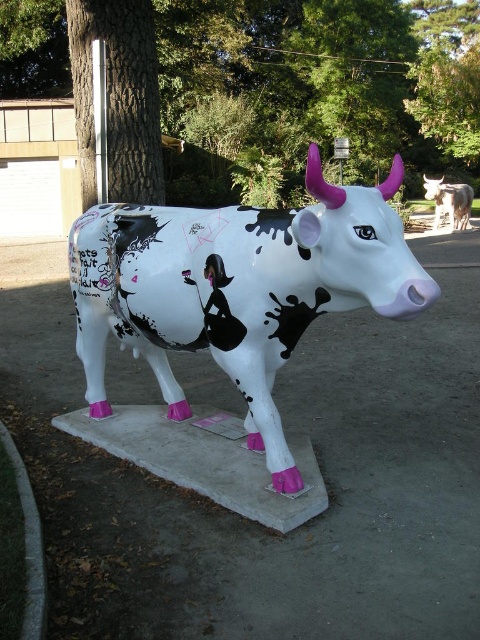
You are an art curator planning to display both the painted plastic cow at center and the white glossy cow at center in an exhibition. Which cow should you place in a more prominent location to emphasize its size difference?

The painted plastic cow at center is larger in size than the white glossy cow at center, so it should be placed in a more prominent location to highlight its larger size.

You are standing 1.8 meters tall and want to take a photo of the sculpture. The camera you are using has a minimum focusing distance of 4 meters. Can you take a clear photo of the point at coordinates point (x=118, y=204) without moving closer?

The point at coordinates point (x=118, y=204) is 3.87 meters away from the camera. Since the camera requires a minimum focusing distance of 4 meters, the distance is too short for the camera to focus properly. Therefore, you cannot take a clear photo of the point at coordinates point (x=118, y=204) without moving closer.